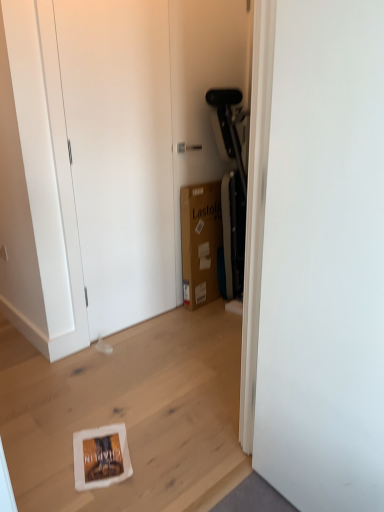
Question: Is white matte door at center, marked as the 1th door in a front-to-back arrangement, positioned beyond the bounds of matte white dresser at center?

Choices:
 (A) no
 (B) yes

Answer: (B)

Question: Considering the relative sizes of white matte door at center, positioned as the 2th door in left-to-right order, and matte white dresser at center in the image provided, is white matte door at center, positioned as the 2th door in left-to-right order, bigger than matte white dresser at center?

Choices:
 (A) no
 (B) yes

Answer: (A)

Question: Does white matte door at center, which appears as the 2th door when viewed from the back, appear on the right side of matte white dresser at center?

Choices:
 (A) no
 (B) yes

Answer: (B)

Question: Is white matte door at center, acting as the 1th door starting from the right, far away from matte white dresser at center?

Choices:
 (A) no
 (B) yes

Answer: (B)

Question: Is white matte door at center, which appears as the 2th door when viewed from the back, to the left of matte white dresser at center from the viewer's perspective?

Choices:
 (A) yes
 (B) no

Answer: (B)

Question: Is white matte door at center, acting as the 1th door starting from the right, positioned behind matte white dresser at center?

Choices:
 (A) yes
 (B) no

Answer: (B)

Question: Considering the relative sizes of brown cardboard box at center and white matte door at upper left, arranged as the 2th door when viewed from the right, in the image provided, is brown cardboard box at center smaller than white matte door at upper left, arranged as the 2th door when viewed from the right,?

Choices:
 (A) yes
 (B) no

Answer: (B)

Question: Does brown cardboard box at center turn towards white matte door at upper left, arranged as the 2th door when viewed from the right?

Choices:
 (A) yes
 (B) no

Answer: (B)

Question: Is brown cardboard box at center to the right of white matte door at upper left, arranged as the 2th door when viewed from the right, from the viewer's perspective?

Choices:
 (A) yes
 (B) no

Answer: (A)

Question: Can you confirm if brown cardboard box at center is taller than white matte door at upper left, the first door viewed from the left?

Choices:
 (A) yes
 (B) no

Answer: (B)

Question: Is brown cardboard box at center positioned beyond the bounds of white matte door at upper left, the 1th door when ordered from back to front?

Choices:
 (A) yes
 (B) no

Answer: (A)

Question: From the image's perspective, does brown cardboard box at center appear lower than white matte door at upper left, the first door viewed from the left?

Choices:
 (A) no
 (B) yes

Answer: (B)

Question: Considering the relative sizes of white matte door at center, positioned as the 2th door in left-to-right order, and brown cardboard box at center in the image provided, is white matte door at center, positioned as the 2th door in left-to-right order, smaller than brown cardboard box at center?

Choices:
 (A) no
 (B) yes

Answer: (A)